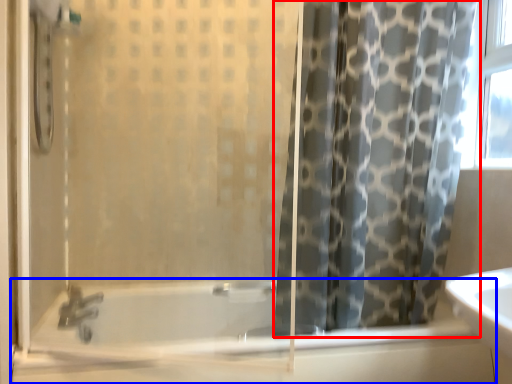
Question: Which of the following is the farthest to the observer, curtain (highlighted by a red box) or bathtub (highlighted by a blue box)?

Choices:
 (A) curtain
 (B) bathtub

Answer: (A)